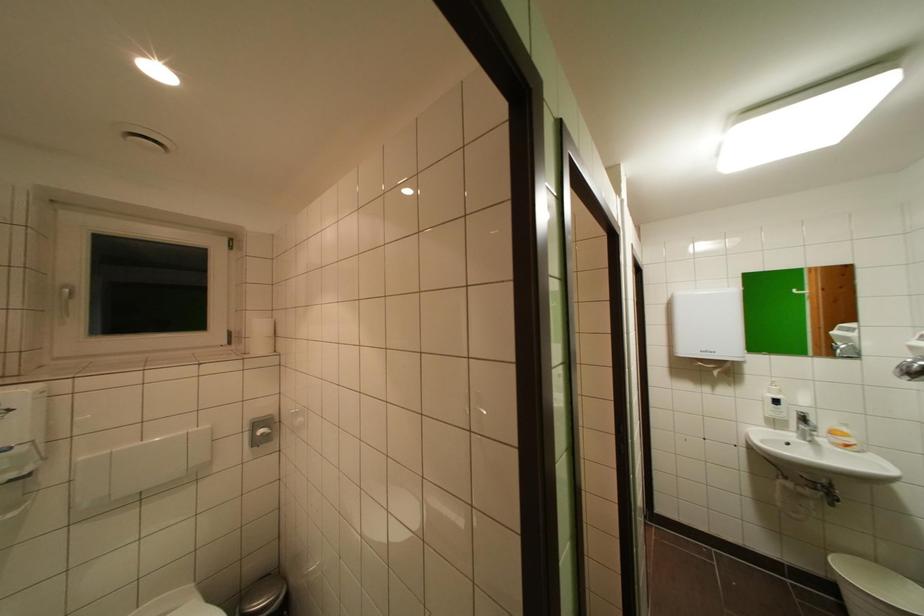
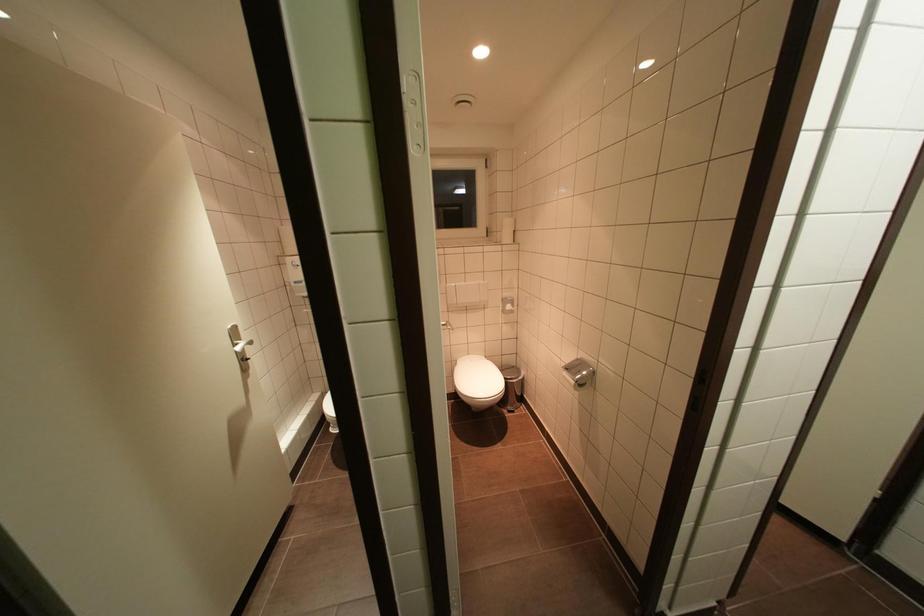
First-person continuous shooting, in which direction is the camera rotating?

The camera rotated toward left-down.